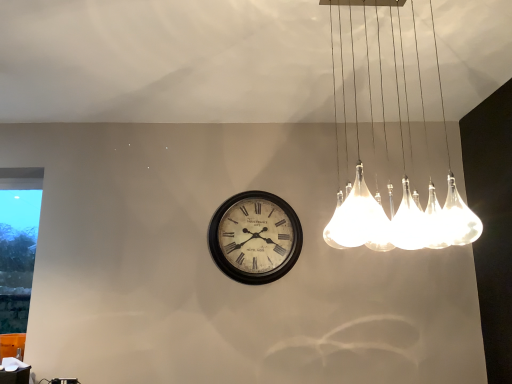
Describe the element at coordinates (413, 213) in the screenshot. I see `clear glass pendant lights at upper right` at that location.

Image resolution: width=512 pixels, height=384 pixels. Describe the element at coordinates (255, 237) in the screenshot. I see `vintage white clock at center` at that location.

The image size is (512, 384). In order to click on vintage white clock at center in this screenshot , I will do `click(255, 237)`.

Locate an element on the screen. transparent glass window at left is located at coordinates (18, 243).

In the image, is white matte table at lower left on the left side or the right side of clear glass pendant lights at upper right?

white matte table at lower left is positioned on clear glass pendant lights at upper right's left side.

From a real-world perspective, between white matte table at lower left and clear glass pendant lights at upper right, who is vertically lower?

In real-world perspective, white matte table at lower left is lower.

Who is taller, white matte table at lower left or clear glass pendant lights at upper right?

clear glass pendant lights at upper right is taller.

Could clear glass pendant lights at upper right be considered to be inside white matte table at lower left?

No, clear glass pendant lights at upper right is not a part of white matte table at lower left.

Which of these two, white matte table at lower left or transparent glass window at left, stands shorter?

white matte table at lower left is shorter.

Can you tell me how much white matte table at lower left and transparent glass window at left differ in facing direction?

They differ by 1.39 degrees in their facing directions.

Which is in front, white matte table at lower left or transparent glass window at left?

Positioned in front is white matte table at lower left.

Does point (13, 383) come behind point (32, 259)?

No, it is in front of (32, 259).

Considering the relative positions of white matte table at lower left and vintage white clock at center in the image provided, is white matte table at lower left to the left of vintage white clock at center from the viewer's perspective?

Correct, you'll find white matte table at lower left to the left of vintage white clock at center.

Considering the positions of objects white matte table at lower left and vintage white clock at center in the image provided, who is behind, white matte table at lower left or vintage white clock at center?

vintage white clock at center is behind.

Where is `table beneath the vintage white clock at center (from a real-world perspective)`? The width and height of the screenshot is (512, 384). table beneath the vintage white clock at center (from a real-world perspective) is located at coordinates (14, 371).

From the image's perspective, does white matte table at lower left appear lower than vintage white clock at center?

Yes, from the image's perspective, white matte table at lower left is below vintage white clock at center.

Is clear glass pendant lights at upper right to the right of white matte table at lower left from the viewer's perspective?

Correct, you'll find clear glass pendant lights at upper right to the right of white matte table at lower left.

Would you say clear glass pendant lights at upper right is outside white matte table at lower left?

Yes, clear glass pendant lights at upper right is located beyond the bounds of white matte table at lower left.

Is clear glass pendant lights at upper right not near white matte table at lower left?

Yes.

Can you confirm if clear glass pendant lights at upper right is shorter than white matte table at lower left?

Incorrect, the height of clear glass pendant lights at upper right does not fall short of that of white matte table at lower left.

From a real-world perspective, is vintage white clock at center positioned above or below white matte table at lower left?

Clearly, from a real-world perspective, vintage white clock at center is above white matte table at lower left.

Is point (222, 226) positioned before point (7, 376)?

That is False.

In terms of height, does vintage white clock at center look taller or shorter compared to white matte table at lower left?

Considering their sizes, vintage white clock at center has more height than white matte table at lower left.

Where is `wall clock on the right of white matte table at lower left`? wall clock on the right of white matte table at lower left is located at coordinates (255, 237).

From the picture: Is transparent glass window at left located outside vintage white clock at center?

Yes, transparent glass window at left is located beyond the bounds of vintage white clock at center.

Does transparent glass window at left have a larger size compared to vintage white clock at center?

Actually, transparent glass window at left might be smaller than vintage white clock at center.

How different are the orientations of transparent glass window at left and vintage white clock at center in degrees?

The facing directions of transparent glass window at left and vintage white clock at center are 0.678 degrees apart.

Which point is more forward, (2,309) or (288,218)?

Positioned in front is point (288,218).

Which is closer to the camera, (9, 215) or (18, 361)?

Point (9, 215).

Which is more to the left, transparent glass window at left or white matte table at lower left?

From the viewer's perspective, transparent glass window at left appears more on the left side.

Is transparent glass window at left directly adjacent to white matte table at lower left?

No, transparent glass window at left is not in contact with white matte table at lower left.

From the image's perspective, which one is positioned higher, transparent glass window at left or white matte table at lower left?

From the image's view, transparent glass window at left is above.

Identify the location of lamp that is above the white matte table at lower left (from a real-world perspective). The image size is (512, 384). tap(413, 213).

Where is `window behind the white matte table at lower left`? window behind the white matte table at lower left is located at coordinates (18, 243).

Based on their spatial positions, is vintage white clock at center or transparent glass window at left further from clear glass pendant lights at upper right?

transparent glass window at left is positioned further to the anchor clear glass pendant lights at upper right.

Based on their spatial positions, is transparent glass window at left or white matte table at lower left further from clear glass pendant lights at upper right?

The object further to clear glass pendant lights at upper right is transparent glass window at left.

Which object lies nearer to the anchor point clear glass pendant lights at upper right, white matte table at lower left or transparent glass window at left?

Based on the image, white matte table at lower left appears to be nearer to clear glass pendant lights at upper right.

Based on the photo, looking at the image, which one is located closer to white matte table at lower left, vintage white clock at center or clear glass pendant lights at upper right?

Based on the image, vintage white clock at center appears to be nearer to white matte table at lower left.

From the image, which object appears to be nearer to transparent glass window at left, white matte table at lower left or vintage white clock at center?

white matte table at lower left is closer to transparent glass window at left.

In the scene shown: Estimate the real-world distances between objects in this image. Which object is further from vintage white clock at center, transparent glass window at left or clear glass pendant lights at upper right?

transparent glass window at left lies further to vintage white clock at center than the other object.

Which object lies nearer to the anchor point white matte table at lower left, vintage white clock at center or transparent glass window at left?

Among the two, vintage white clock at center is located nearer to white matte table at lower left.

Looking at the image, which one is located further to transparent glass window at left, clear glass pendant lights at upper right or white matte table at lower left?

clear glass pendant lights at upper right is positioned further to the anchor transparent glass window at left.

Locate an element on the screen. table between transparent glass window at left and vintage white clock at center from left to right is located at coordinates (x=14, y=371).

Locate an element on the screen. wall clock between white matte table at lower left and clear glass pendant lights at upper right from left to right is located at coordinates (255, 237).

The image size is (512, 384). In order to click on table between transparent glass window at left and clear glass pendant lights at upper right in this screenshot , I will do `click(14, 371)`.

Locate an element on the screen. This screenshot has width=512, height=384. wall clock located between transparent glass window at left and clear glass pendant lights at upper right in the left-right direction is located at coordinates click(x=255, y=237).